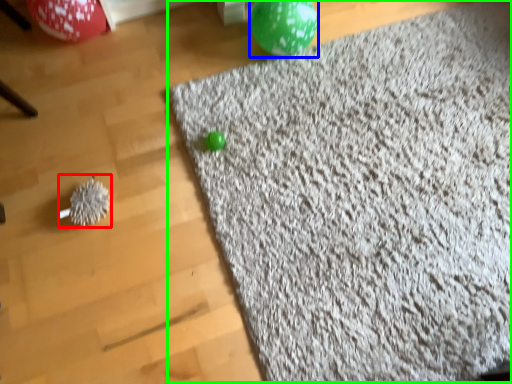
Question: Based on their relative distances, which object is nearer to toy (highlighted by a red box)? Choose from balloon (highlighted by a blue box) and mat (highlighted by a green box).

Choices:
 (A) balloon
 (B) mat

Answer: (B)